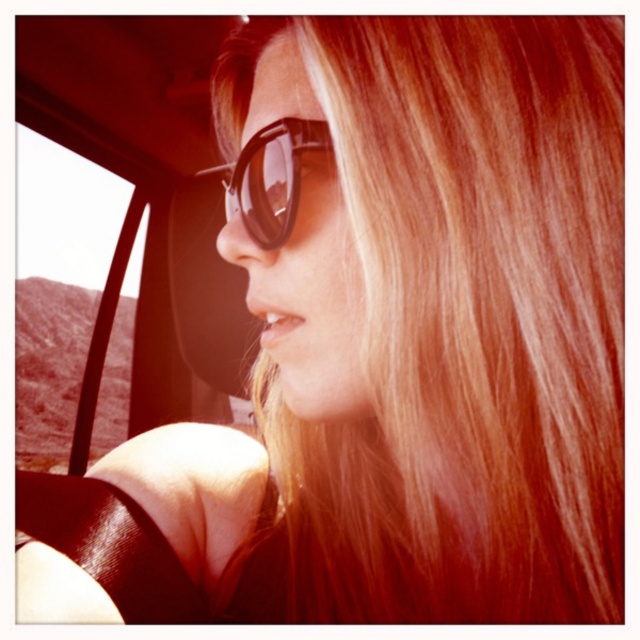
Question: Is transparent glass car window at left above black plastic goggles at center?

Choices:
 (A) yes
 (B) no

Answer: (B)

Question: Among these objects, which one is nearest to the camera?

Choices:
 (A) black plastic goggles at center
 (B) transparent glass car window at left

Answer: (A)

Question: Does transparent glass car window at left have a smaller size compared to black plastic goggles at center?

Choices:
 (A) no
 (B) yes

Answer: (A)

Question: Which of the following is the farthest from the observer?

Choices:
 (A) black plastic goggles at center
 (B) transparent glass car window at left

Answer: (B)

Question: Does transparent glass car window at left have a greater width compared to black plastic goggles at center?

Choices:
 (A) no
 (B) yes

Answer: (B)